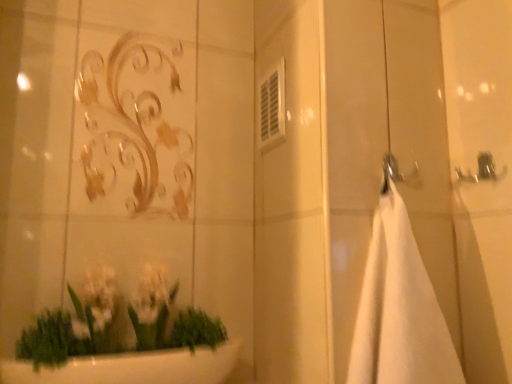
What is the approximate height of white matte towel at right?

It is 14.52 inches.

Find the location of a particular element. Image resolution: width=512 pixels, height=384 pixels. white matte towel at right is located at coordinates (399, 310).

The image size is (512, 384). Describe the element at coordinates (399, 310) in the screenshot. I see `white matte towel at right` at that location.

What do you see at coordinates (124, 352) in the screenshot?
I see `white glossy plant at lower left` at bounding box center [124, 352].

In order to click on white glossy plant at lower left in this screenshot , I will do `click(124, 352)`.

Where is `white matte towel at right`? white matte towel at right is located at coordinates (399, 310).

Consider the image. Can you confirm if white glossy plant at lower left is positioned to the right of white matte towel at right?

No.

Between white glossy plant at lower left and white matte towel at right, which one is positioned in front?

white matte towel at right is more forward.

Does point (66, 324) lie behind point (379, 335)?

Yes.

Consider the image. From the image's perspective, who appears lower, white glossy plant at lower left or white matte towel at right?

white glossy plant at lower left appears lower in the image.

From a real-world perspective, which object stands above the other?

In real-world perspective, white matte towel at right is above.

Considering the relative sizes of white glossy plant at lower left and white matte towel at right in the image provided, is white glossy plant at lower left thinner than white matte towel at right?

Incorrect, the width of white glossy plant at lower left is not less than that of white matte towel at right.

Can you confirm if white glossy plant at lower left is shorter than white matte towel at right?

Indeed, white glossy plant at lower left has a lesser height compared to white matte towel at right.

Considering the relative sizes of white glossy plant at lower left and white matte towel at right in the image provided, is white glossy plant at lower left bigger than white matte towel at right?

Yes.

Is white matte towel at right completely or partially inside white glossy plant at lower left?

Definitely not — white matte towel at right is not inside white glossy plant at lower left.

Does white glossy plant at lower left touch white matte towel at right?

white glossy plant at lower left is not next to white matte towel at right, and they're not touching.

Is white glossy plant at lower left oriented away from white matte towel at right?

white glossy plant at lower left does not have its back to white matte towel at right.

Identify the location of houseplant behind the white matte towel at right. The height and width of the screenshot is (384, 512). (124, 352).

Based on the photo, does white matte towel at right appear on the left side of white glossy plant at lower left?

No.

Is white matte towel at right further to the viewer compared to white glossy plant at lower left?

No, white matte towel at right is in front of white glossy plant at lower left.

Which is closer, (409, 226) or (137, 304)?

The point (409, 226) is closer to the camera.

From the image's perspective, is white matte towel at right over white glossy plant at lower left?

Yes, from the image's perspective, white matte towel at right is above white glossy plant at lower left.

From a real-world perspective, is white matte towel at right located beneath white glossy plant at lower left?

Incorrect, from a real-world perspective, white matte towel at right is higher than white glossy plant at lower left.

Which of these two, white matte towel at right or white glossy plant at lower left, is wider?

Wider between the two is white glossy plant at lower left.

Considering the sizes of objects white matte towel at right and white glossy plant at lower left in the image provided, who is taller, white matte towel at right or white glossy plant at lower left?

With more height is white matte towel at right.

Based on their sizes in the image, would you say white matte towel at right is bigger or smaller than white glossy plant at lower left?

Considering their sizes, white matte towel at right takes up less space than white glossy plant at lower left.

Is white matte towel at right located outside white glossy plant at lower left?

white matte towel at right is positioned outside white glossy plant at lower left.

Is white matte towel at right beside white glossy plant at lower left?

white matte towel at right and white glossy plant at lower left are clearly separated.

Is white matte towel at right oriented towards white glossy plant at lower left?

No, white matte towel at right is not turned towards white glossy plant at lower left.

In the image, there is a white glossy plant at lower left. Where is `bath towel above it (from the image's perspective)`? bath towel above it (from the image's perspective) is located at coordinates (399, 310).

Locate an element on the screen. The image size is (512, 384). houseplant that appears on the left of white matte towel at right is located at coordinates (124, 352).

Where is `houseplant lying below the white matte towel at right (from the image's perspective)`? houseplant lying below the white matte towel at right (from the image's perspective) is located at coordinates (124, 352).